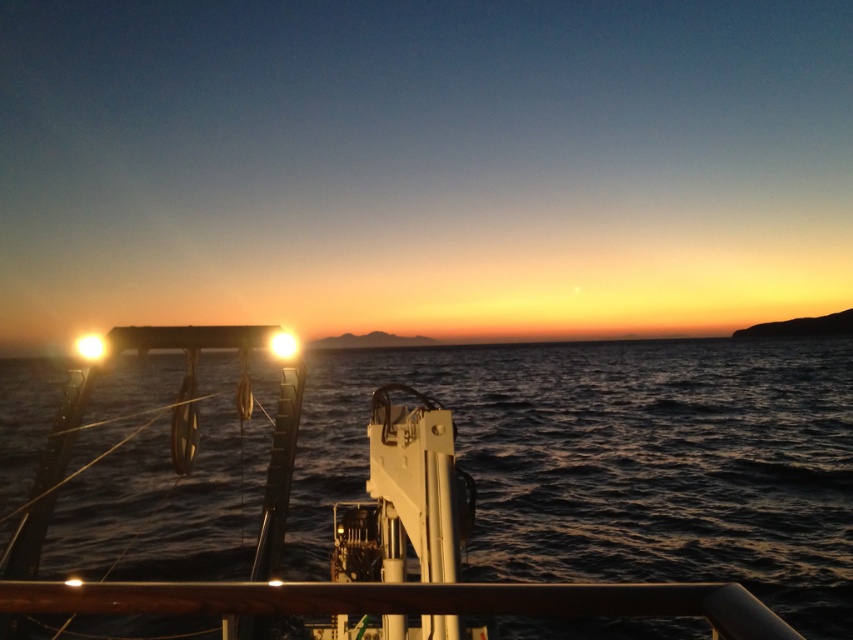
Is dark blue water at center taller than brown polished wood rail at lower center?

Yes.

Image resolution: width=853 pixels, height=640 pixels. In order to click on dark blue water at center in this screenshot , I will do `click(618, 461)`.

Image resolution: width=853 pixels, height=640 pixels. Find the location of `dark blue water at center`. dark blue water at center is located at coordinates (618, 461).